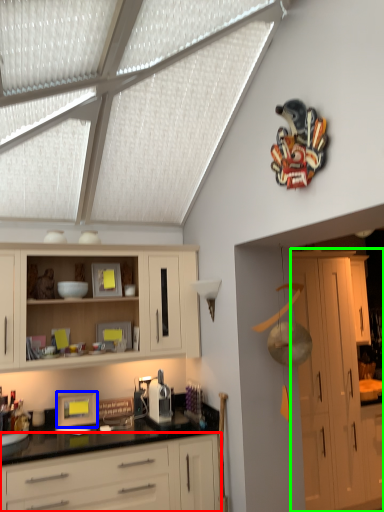
Question: Considering the real-world distances, which object is closest to cabinetry (highlighted by a red box)? picture frame (highlighted by a blue box) or cabinetry (highlighted by a green box).

Choices:
 (A) picture frame
 (B) cabinetry

Answer: (A)